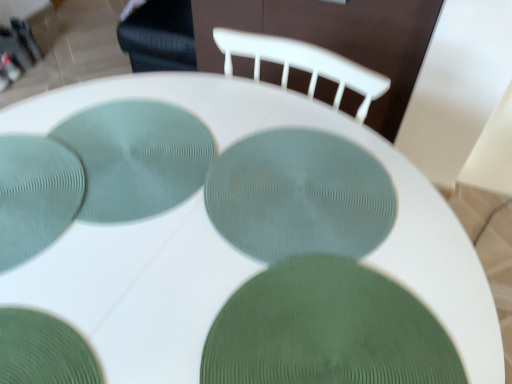
Locate an element on the screen. Image resolution: width=512 pixels, height=384 pixels. vacant space behind teal textured placemat at center, which ranks as the third glass plate in right-to-left order is located at coordinates (157, 90).